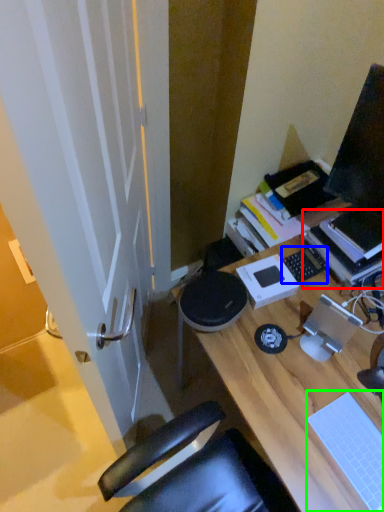
Question: Which is farther away from book (highlighted by a red box)? laptop keyboard (highlighted by a blue box) or laptop keyboard (highlighted by a green box)?

Choices:
 (A) laptop keyboard
 (B) laptop keyboard

Answer: (B)